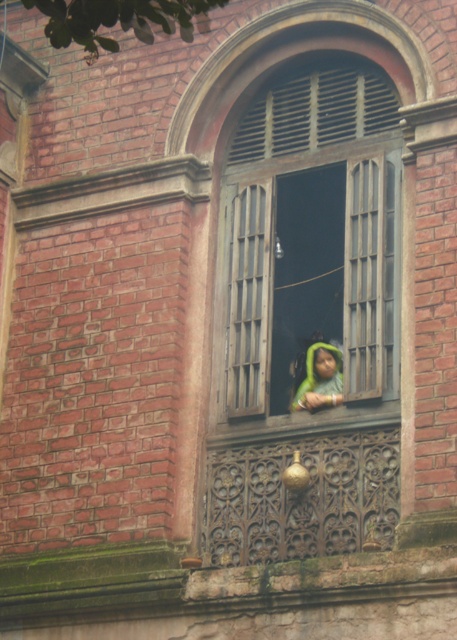
Describe the element at coordinates (308, 241) in the screenshot. The width and height of the screenshot is (457, 640). I see `wooden window at center` at that location.

Does wooden window at center come in front of green fabric at center?

Yes, it is in front of green fabric at center.

Which is behind, point (314, 136) or point (334, 355)?

The point (314, 136) is more distant.

Image resolution: width=457 pixels, height=640 pixels. In order to click on wooden window at center in this screenshot , I will do `click(308, 241)`.